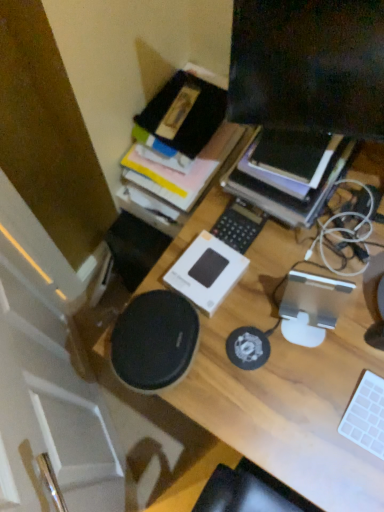
Measure the distance between white matte keyboard at lower right, which is the second laptop keyboard from left to right, and camera.

white matte keyboard at lower right, which is the second laptop keyboard from left to right, and camera are 76.60 centimeters apart.

In order to face wooden desk at center, should I rotate leftwards or rightwards?

Rotate right and turn 20.457 degrees.

This screenshot has width=384, height=512. In order to click on matte black monitor at upper right in this screenshot , I will do `click(308, 65)`.

Image resolution: width=384 pixels, height=512 pixels. What do you see at coordinates (286, 187) in the screenshot? I see `black matte book at upper right` at bounding box center [286, 187].

Locate an element on the screen. The image size is (384, 512). white plastic keyboard at center, which is counted as the first laptop keyboard, starting from the left is located at coordinates (239, 225).

Identify the location of black matte speaker at center. (154, 341).

I want to click on white matte keyboard at lower right, which is the second laptop keyboard from left to right, so tap(366, 415).

Which object is positioned more to the left, black matte book at upper right or matte black monitor at upper right?

Positioned to the left is matte black monitor at upper right.

Is matte black monitor at upper right a part of black matte book at upper right?

Definitely not — matte black monitor at upper right is not inside black matte book at upper right.

Considering the relative sizes of black matte book at upper right and matte black monitor at upper right in the image provided, is black matte book at upper right shorter than matte black monitor at upper right?

Yes, black matte book at upper right is shorter than matte black monitor at upper right.

Relative to matte black monitor at upper right, is black matte book at upper right in front or behind?

black matte book at upper right is positioned farther from the viewer than matte black monitor at upper right.

Which object is further away from the camera taking this photo, white plastic keyboard at center, arranged as the 1th laptop keyboard when viewed from the top, or black matte book at upper right?

Positioned behind is white plastic keyboard at center, arranged as the 1th laptop keyboard when viewed from the top.

From a real-world perspective, starting from the black matte book at upper right, which laptop keyboard is the 1st one below it? Please provide its 2D coordinates.

[(239, 225)]

How many degrees apart are the facing directions of white plastic keyboard at center, marked as the second laptop keyboard in a bottom-to-top arrangement, and black matte book at upper right?

The facing directions of white plastic keyboard at center, marked as the second laptop keyboard in a bottom-to-top arrangement, and black matte book at upper right are 1.78 degrees apart.

From a real-world perspective, is matte black monitor at upper right positioned above or below white matte keyboard at lower right, which is the second laptop keyboard from left to right?

In terms of real-world spatial position, matte black monitor at upper right is above white matte keyboard at lower right, which is the second laptop keyboard from left to right.

Do you think matte black monitor at upper right is within white matte keyboard at lower right, which ranks as the first laptop keyboard in front-to-back order, or outside of it?

matte black monitor at upper right lies outside white matte keyboard at lower right, which ranks as the first laptop keyboard in front-to-back order.

Does matte black monitor at upper right have a larger size compared to white matte keyboard at lower right, the first laptop keyboard from the right?

Indeed, matte black monitor at upper right has a larger size compared to white matte keyboard at lower right, the first laptop keyboard from the right.

Is matte black monitor at upper right not close to white matte keyboard at lower right, the first laptop keyboard from the right?

They are positioned close to each other.

Does point (124, 352) come in front of point (273, 203)?

Yes, point (124, 352) is closer to viewer.

How many degrees apart are the facing directions of black matte speaker at center and black matte book at upper right?

The angular difference between black matte speaker at center and black matte book at upper right is 1.2 degrees.

Which object is further away from the camera taking this photo, black matte speaker at center or black matte book at upper right?

Positioned behind is black matte book at upper right.

Is black matte speaker at center far from black matte book at upper right?

No, there isn't a large distance between black matte speaker at center and black matte book at upper right.

Looking at this image, which is correct: black matte book at upper right is inside white plastic keyboard at center, which is counted as the 2th laptop keyboard, starting from the front, or outside of it?

black matte book at upper right exists outside the volume of white plastic keyboard at center, which is counted as the 2th laptop keyboard, starting from the front.

Is black matte book at upper right oriented away from white plastic keyboard at center, the 1th laptop keyboard in the back-to-front sequence?

No, black matte book at upper right is not facing the opposite direction of white plastic keyboard at center, the 1th laptop keyboard in the back-to-front sequence.

Consider the image. Considering the sizes of objects black matte book at upper right and white plastic keyboard at center, marked as the second laptop keyboard in a bottom-to-top arrangement, in the image provided, who is shorter, black matte book at upper right or white plastic keyboard at center, marked as the second laptop keyboard in a bottom-to-top arrangement,?

With less height is white plastic keyboard at center, marked as the second laptop keyboard in a bottom-to-top arrangement.

Locate an element on the screen. The image size is (384, 512). the 1st laptop keyboard located beneath the black matte book at upper right (from a real-world perspective) is located at coordinates (239, 225).

Looking at this image, how distant is matte black monitor at upper right from white plastic keyboard at center, which is counted as the 2th laptop keyboard, starting from the front?

A distance of 30.35 centimeters exists between matte black monitor at upper right and white plastic keyboard at center, which is counted as the 2th laptop keyboard, starting from the front.

From the image's perspective, is matte black monitor at upper right beneath white plastic keyboard at center, placed as the 2th laptop keyboard when sorted from right to left?

No, from the image's perspective, matte black monitor at upper right is not beneath white plastic keyboard at center, placed as the 2th laptop keyboard when sorted from right to left.

Between matte black monitor at upper right and white plastic keyboard at center, the 1th laptop keyboard in the back-to-front sequence, which one is positioned in front?

matte black monitor at upper right is closer to the camera.

Is black matte speaker at center facing towards matte black monitor at upper right?

No.

From a real-world perspective, is black matte speaker at center physically located above or below matte black monitor at upper right?

From a real-world perspective, black matte speaker at center is physically below matte black monitor at upper right.

Is black matte speaker at center positioned before matte black monitor at upper right?

No, it is behind matte black monitor at upper right.

Looking at their sizes, would you say black matte speaker at center is wider or thinner than matte black monitor at upper right?

Clearly, black matte speaker at center has more width compared to matte black monitor at upper right.

Identify the location of paperback book that is behind the matte black monitor at upper right. Image resolution: width=384 pixels, height=512 pixels. (286, 187).

The image size is (384, 512). What are the coordinates of `the 1st laptop keyboard below when counting from the black matte book at upper right (from the image's perspective)` in the screenshot? It's located at (239, 225).

Based on their spatial positions, is wooden desk at center or black matte book at upper right closer to black matte speaker at center?

wooden desk at center.

Estimate the real-world distances between objects in this image. Which object is further from white matte keyboard at lower right, which is the second laptop keyboard from left to right, black matte book at upper right or wooden desk at center?

black matte book at upper right is positioned further to the anchor white matte keyboard at lower right, which is the second laptop keyboard from left to right.

Based on their spatial positions, is white plastic keyboard at center, which is counted as the first laptop keyboard, starting from the left, or wooden desk at center closer to white matte keyboard at lower right, which ranks as the first laptop keyboard in front-to-back order?

wooden desk at center is positioned closer to the anchor white matte keyboard at lower right, which ranks as the first laptop keyboard in front-to-back order.

Which object lies nearer to the anchor point white matte keyboard at lower right, acting as the second laptop keyboard starting from the back, black matte speaker at center or white plastic keyboard at center, which is counted as the first laptop keyboard, starting from the left?

The object closer to white matte keyboard at lower right, acting as the second laptop keyboard starting from the back, is black matte speaker at center.

Which object lies nearer to the anchor point black matte book at upper right, white matte keyboard at lower right, which ranks as the first laptop keyboard in front-to-back order, or matte black monitor at upper right?

matte black monitor at upper right is closer to black matte book at upper right.

Estimate the real-world distances between objects in this image. Which object is further from wooden desk at center, black matte speaker at center or black matte book at upper right?

The object further to wooden desk at center is black matte book at upper right.

When comparing their distances from matte black monitor at upper right, does white plastic keyboard at center, marked as the second laptop keyboard in a bottom-to-top arrangement, or white matte keyboard at lower right, placed as the 2th laptop keyboard when sorted from top to bottom, seem closer?

Based on the image, white plastic keyboard at center, marked as the second laptop keyboard in a bottom-to-top arrangement, appears to be nearer to matte black monitor at upper right.

Looking at the image, which one is located closer to black matte book at upper right, wooden desk at center or matte black monitor at upper right?

wooden desk at center is positioned closer to the anchor black matte book at upper right.

I want to click on paperback book between matte black monitor at upper right and wooden desk at center in the up-down direction, so click(x=286, y=187).

Where is `laptop keyboard between matte black monitor at upper right and white matte keyboard at lower right, placed as the 2th laptop keyboard when sorted from top to bottom, in the vertical direction`? This screenshot has height=512, width=384. laptop keyboard between matte black monitor at upper right and white matte keyboard at lower right, placed as the 2th laptop keyboard when sorted from top to bottom, in the vertical direction is located at coordinates (239, 225).

Where is `paperback book between matte black monitor at upper right and white plastic keyboard at center, the 1th laptop keyboard in the back-to-front sequence, from front to back`? paperback book between matte black monitor at upper right and white plastic keyboard at center, the 1th laptop keyboard in the back-to-front sequence, from front to back is located at coordinates (286, 187).

Locate an element on the screen. The width and height of the screenshot is (384, 512). speaker that lies between matte black monitor at upper right and wooden desk at center from top to bottom is located at coordinates (154, 341).